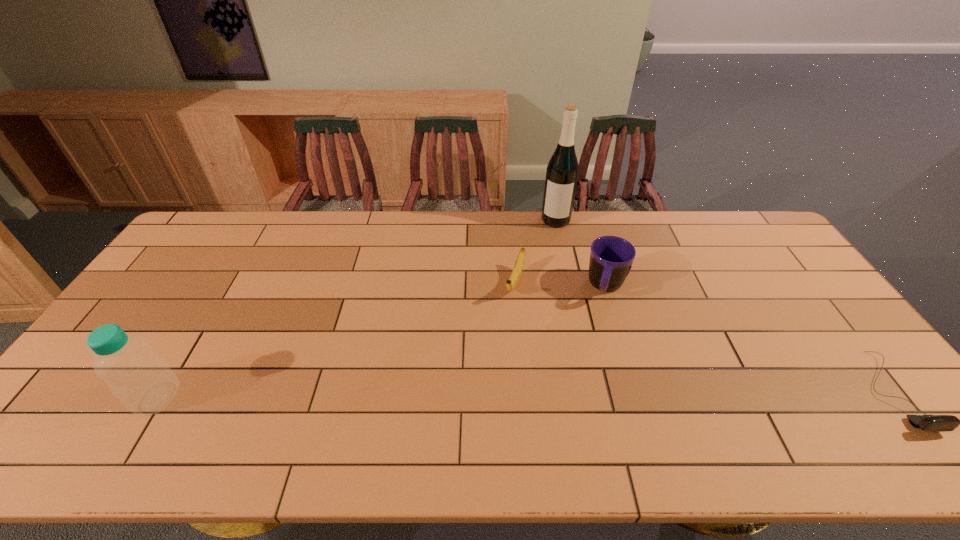
Find the location of a particular element. vacant region located at the stem of the banana is located at coordinates (508, 316).

Image resolution: width=960 pixels, height=540 pixels. In order to click on vacant position located 0.200m at the stem of the banana in this screenshot , I will do `click(493, 353)`.

Locate an element on the screen. The width and height of the screenshot is (960, 540). vacant space located at the stem of the banana is located at coordinates (504, 326).

The image size is (960, 540). Identify the location of free location located on the label of the tallest object. (549, 258).

You are a GUI agent. You are given a task and a screenshot of the screen. Output one action in this format:
    pyautogui.click(x=<x>, y=<y>)
    Task: Click on the free region located on the label of the tallest object
    Image resolution: width=960 pixels, height=540 pixels.
    Given the screenshot: What is the action you would take?
    pyautogui.click(x=548, y=266)

At what (x,y) coordinates should I click in order to perform the action: click on blank space located on the label of the tallest object. Please return your answer as a coordinate pair (x, y). The width and height of the screenshot is (960, 540). Looking at the image, I should click on (550, 254).

Locate an element on the screen. Image resolution: width=960 pixels, height=540 pixels. vacant region located with the handle on the side of the third shortest object is located at coordinates (600, 320).

Where is `free space located 0.140m with the handle on the side of the third shortest object`? This screenshot has width=960, height=540. free space located 0.140m with the handle on the side of the third shortest object is located at coordinates (595, 341).

At what (x,y) coordinates should I click in order to perform the action: click on free space located with the handle on the side of the third shortest object. Please return your answer as a coordinate pair (x, y). This screenshot has height=540, width=960. Looking at the image, I should click on (582, 394).

Locate an element on the screen. This screenshot has width=960, height=540. object positioned at the far edge is located at coordinates (562, 171).